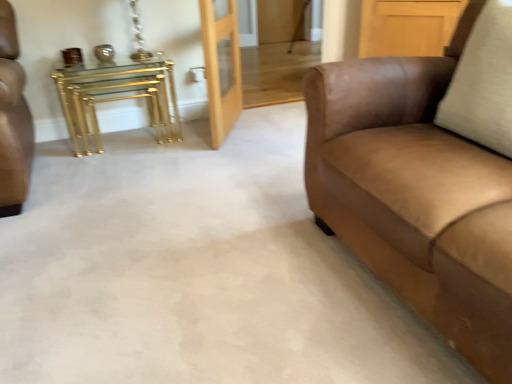
Question: Is the position of suede brown couch at right less distant than that of light wood/glass door at center?

Choices:
 (A) no
 (B) yes

Answer: (B)

Question: Could you tell me if suede brown couch at right is facing light wood/glass door at center?

Choices:
 (A) no
 (B) yes

Answer: (A)

Question: Is suede brown couch at right to the right of light wood/glass door at center from the viewer's perspective?

Choices:
 (A) no
 (B) yes

Answer: (B)

Question: Would you say suede brown couch at right is outside light wood/glass door at center?

Choices:
 (A) yes
 (B) no

Answer: (A)

Question: Is suede brown couch at right facing away from light wood/glass door at center?

Choices:
 (A) no
 (B) yes

Answer: (A)

Question: From a real-world perspective, is light wood/glass door at center above or below suede brown couch at right?

Choices:
 (A) above
 (B) below

Answer: (B)

Question: Is point (232, 1) closer or farther from the camera than point (488, 339)?

Choices:
 (A) closer
 (B) farther

Answer: (B)

Question: Looking at their shapes, would you say light wood/glass door at center is wider or thinner than suede brown couch at right?

Choices:
 (A) wide
 (B) thin

Answer: (B)

Question: From the image's perspective, is light wood/glass door at center above or below suede brown couch at right?

Choices:
 (A) below
 (B) above

Answer: (B)

Question: Is point (80, 150) closer or farther from the camera than point (437, 100)?

Choices:
 (A) closer
 (B) farther

Answer: (B)

Question: Looking at their shapes, would you say gold metallic nesting tables at left is wider or thinner than suede brown couch at right?

Choices:
 (A) thin
 (B) wide

Answer: (A)

Question: Is gold metallic nesting tables at left taller or shorter than suede brown couch at right?

Choices:
 (A) tall
 (B) short

Answer: (B)

Question: From a real-world perspective, is gold metallic nesting tables at left above or below suede brown couch at right?

Choices:
 (A) above
 (B) below

Answer: (B)

Question: Do you think gold metallic nesting tables at left is within light wood/glass door at center, or outside of it?

Choices:
 (A) inside
 (B) outside

Answer: (B)

Question: From the image's perspective, is gold metallic nesting tables at left positioned above or below light wood/glass door at center?

Choices:
 (A) below
 (B) above

Answer: (A)